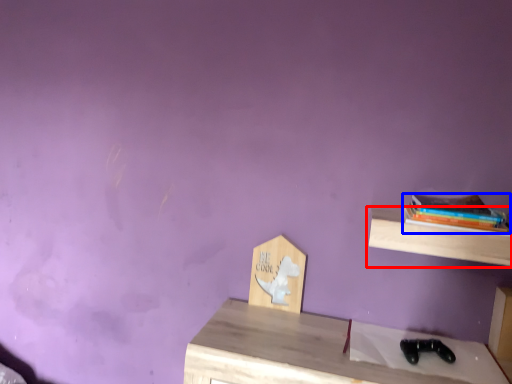
Question: Which object appears farthest to the camera in this image, shelf (highlighted by a red box) or book (highlighted by a blue box)?

Choices:
 (A) shelf
 (B) book

Answer: (B)